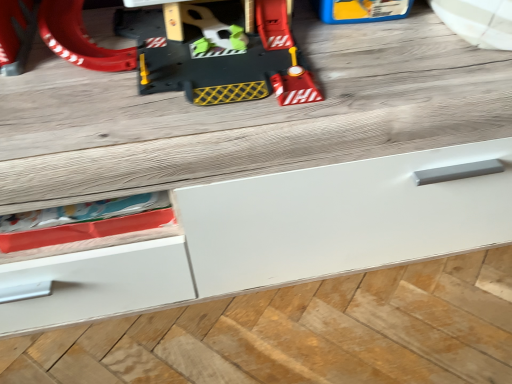
The height and width of the screenshot is (384, 512). Identify the location of unoccupied region to the right of plastic toy train at upper center. (389, 50).